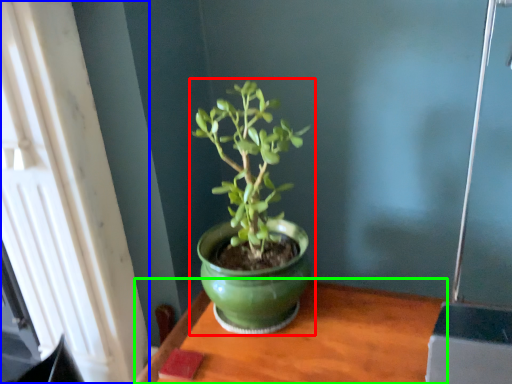
Question: Estimate the real-world distances between objects in this image. Which object is farther from houseplant (highlighted by a red box), window (highlighted by a blue box) or table (highlighted by a green box)?

Choices:
 (A) window
 (B) table

Answer: (A)